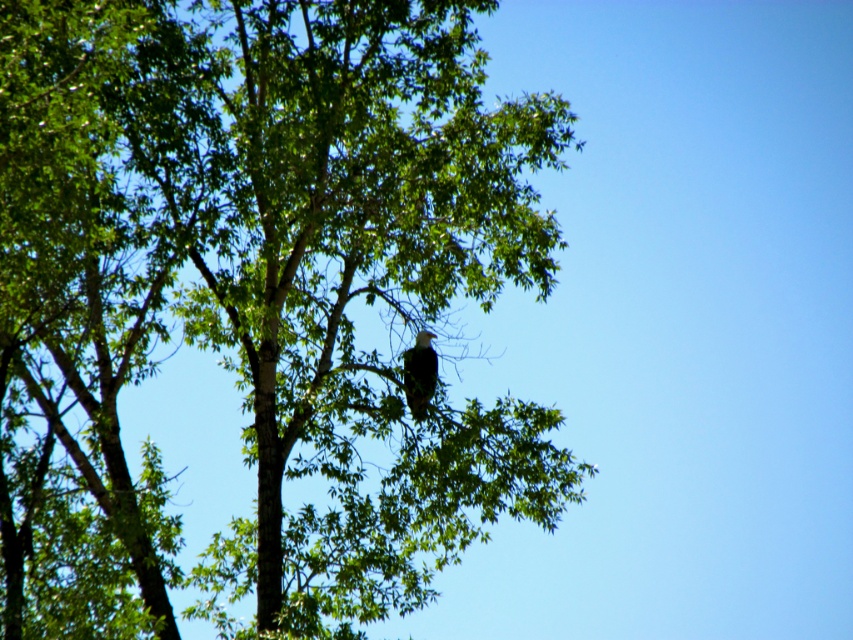
You are a photographer trying to capture the white feathered eagle at center in your shot. However, the green leafy tree at center is blocking your view. Can you adjust your position to see the eagle clearly?

The green leafy tree at center is in front of the white feathered eagle at center, so you need to move your position to the side or behind the tree to see the eagle clearly.

In the scene shown: You are a wildlife photographer aiming to capture a clear photo of the white feathered eagle at center. The green leafy tree at center is blocking part of your view. Can you adjust your position to get an unobstructed shot of the eagle?

The green leafy tree at center is larger in size than white feathered eagle at center, so adjusting your position might help you find an angle where the eagle is not obstructed by the tree.